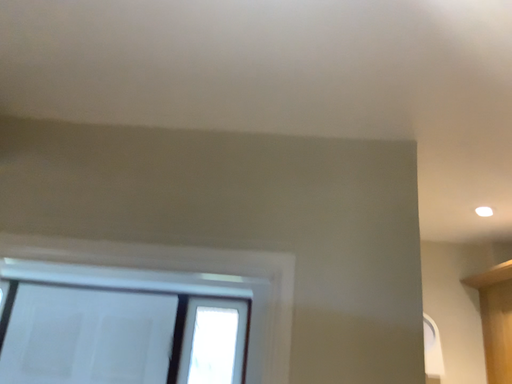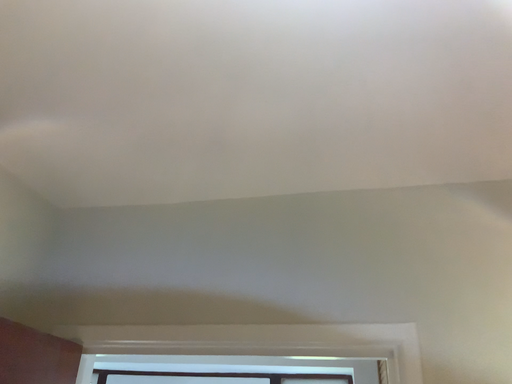
Question: How did the camera likely rotate when shooting the video?

Choices:
 (A) rotated left
 (B) rotated right

Answer: (A)